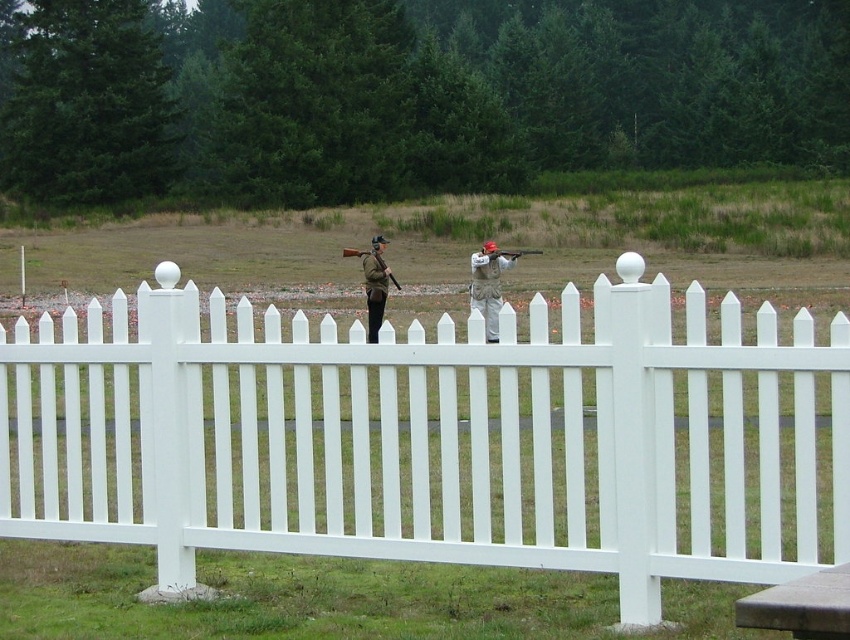
Which of these two, white picket fence at center or wooden shotgun at center, stands shorter?

Standing shorter between the two is wooden shotgun at center.

Is white picket fence at center shorter than wooden shotgun at center?

Incorrect, white picket fence at center's height does not fall short of wooden shotgun at center's.

Locate an element on the screen. The height and width of the screenshot is (640, 850). white picket fence at center is located at coordinates (435, 436).

Can you confirm if khaki fabric uniform at center is smaller than matte brown shotgun at center?

Actually, khaki fabric uniform at center might be larger than matte brown shotgun at center.

Locate an element on the screen. This screenshot has width=850, height=640. khaki fabric uniform at center is located at coordinates (488, 284).

Find the location of a particular element. Image resolution: width=850 pixels, height=640 pixels. khaki fabric uniform at center is located at coordinates (488, 284).

Does camouflage fabric uniform at center come behind matte brown shotgun at center?

That is False.

Who is lower down, camouflage fabric uniform at center or matte brown shotgun at center?

camouflage fabric uniform at center is below.

Does point (380, 237) come in front of point (540, 253)?

Yes, it is.

Find the location of a particular element. This screenshot has height=640, width=850. camouflage fabric uniform at center is located at coordinates (375, 285).